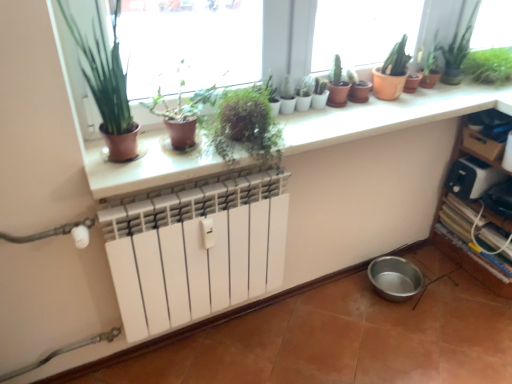
Question: From the image's perspective, is terracotta clay pots at upper center above or below white plastic toaster at right?

Choices:
 (A) above
 (B) below

Answer: (A)

Question: Looking at their shapes, would you say terracotta clay pots at upper center is wider or thinner than white plastic toaster at right?

Choices:
 (A) wide
 (B) thin

Answer: (A)

Question: Which of these objects is positioned farthest from the white matte radiator at center?

Choices:
 (A) green leafy plant at upper right, positioned as the 6th houseplant in left-to-right order
 (B) green matte plant at upper left, which ranks as the sixth houseplant in right-to-left order
 (C) green matte plant at upper center, marked as the 3th houseplant in a left-to-right arrangement
 (D) terracotta clay pots at upper center
 (E) green matte cactus at center, the third houseplant viewed from the right

Answer: (A)

Question: Which is nearer to the green matte plant at upper center, marked as the 3th houseplant in a left-to-right arrangement?

Choices:
 (A) wooden shelf at lower right
 (B) green matte plant at center, arranged as the 2th houseplant when viewed from the left
 (C) white plastic toaster at right
 (D) green matte cactus at upper right, which appears as the 2th houseplant when viewed from the right
 (E) green matte plant at upper left

Answer: (B)